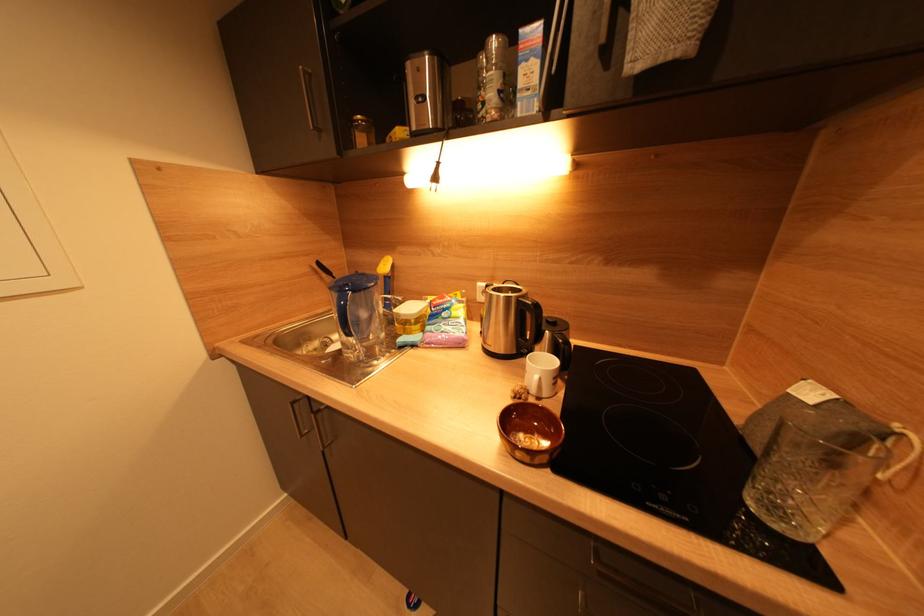
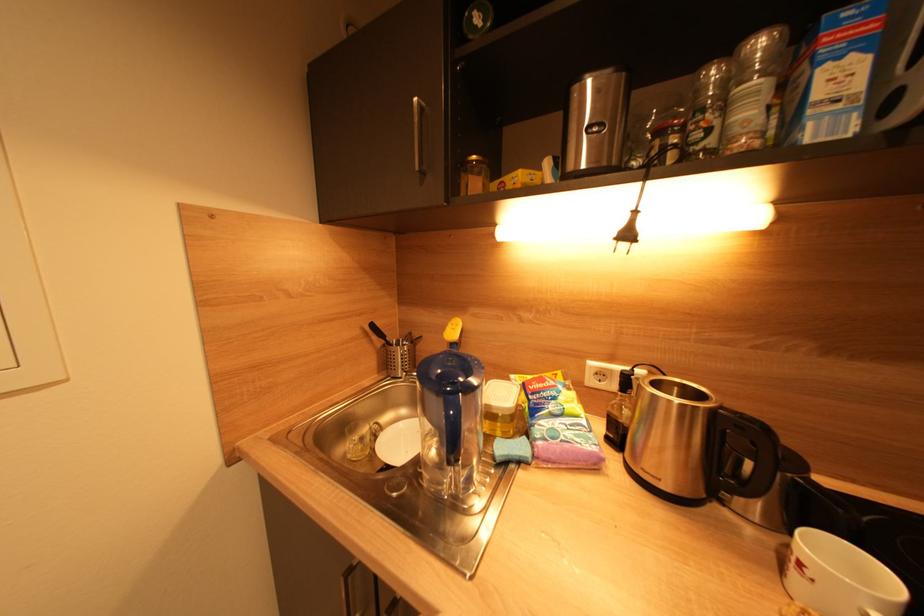
The images are taken continuously from a first-person perspective. In which direction are you moving?

The cameraman moved toward left, forward.